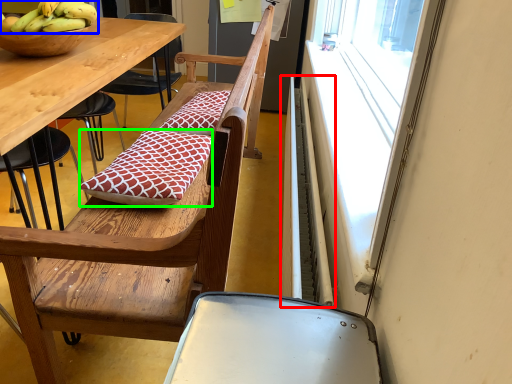
Question: Estimate the real-world distances between objects in this image. Which object is farther from radiator (highlighted by a red box), banana (highlighted by a blue box) or pillow (highlighted by a green box)?

Choices:
 (A) banana
 (B) pillow

Answer: (A)